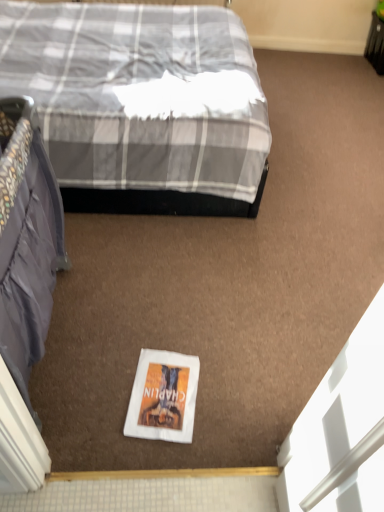
Image resolution: width=384 pixels, height=512 pixels. I want to click on free spot above white paper at center (from a real-world perspective), so click(x=163, y=391).